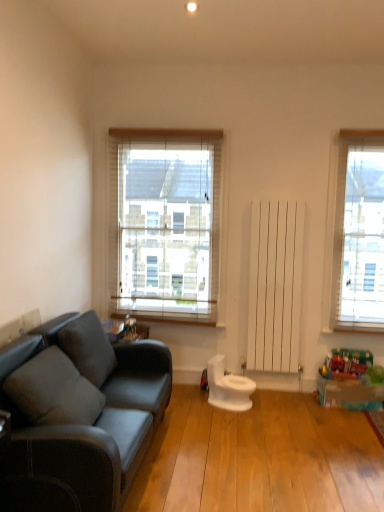
Identify the location of free space in front of translucent plastic toy at lower right, the second toy positioned from the left. (349, 422).